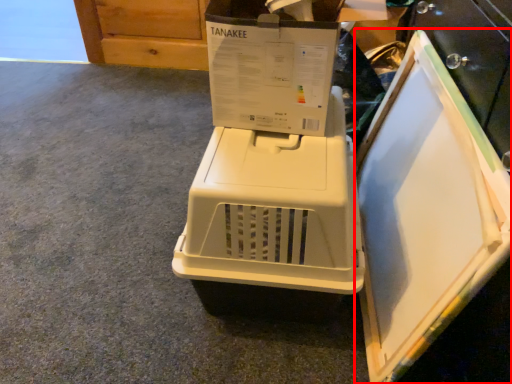
Question: In this image, where is appliance (annotated by the red box) located relative to home appliance?

Choices:
 (A) right
 (B) left

Answer: (A)